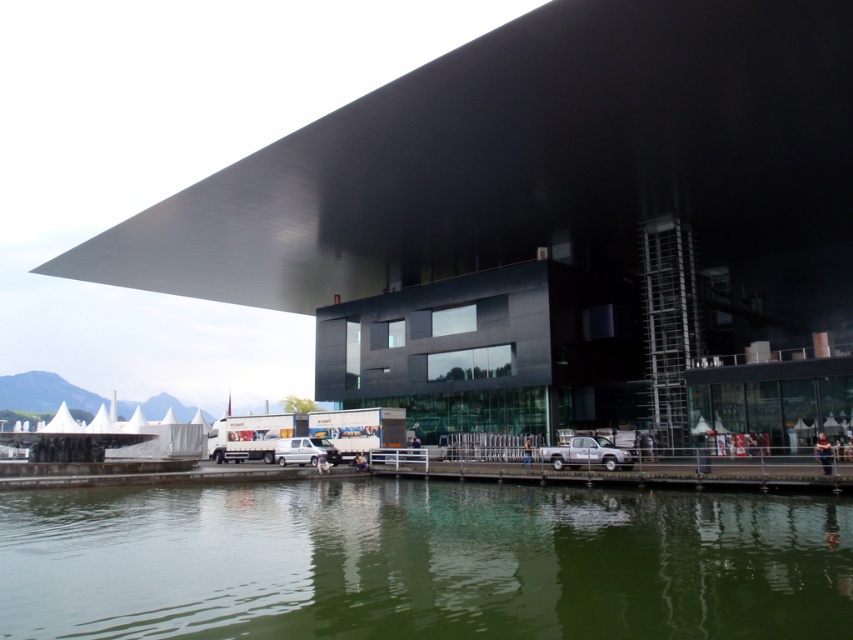
Question: Is green liquid water at lower center thinner than metallic dock at lower center?

Choices:
 (A) yes
 (B) no

Answer: (B)

Question: In this image, where is green liquid water at lower center located relative to metallic dock at lower center?

Choices:
 (A) below
 (B) above

Answer: (B)

Question: Which object appears closest to the camera in this image?

Choices:
 (A) metallic dock at lower center
 (B) green liquid water at lower center

Answer: (B)

Question: Can you confirm if green liquid water at lower center is wider than metallic dock at lower center?

Choices:
 (A) no
 (B) yes

Answer: (B)